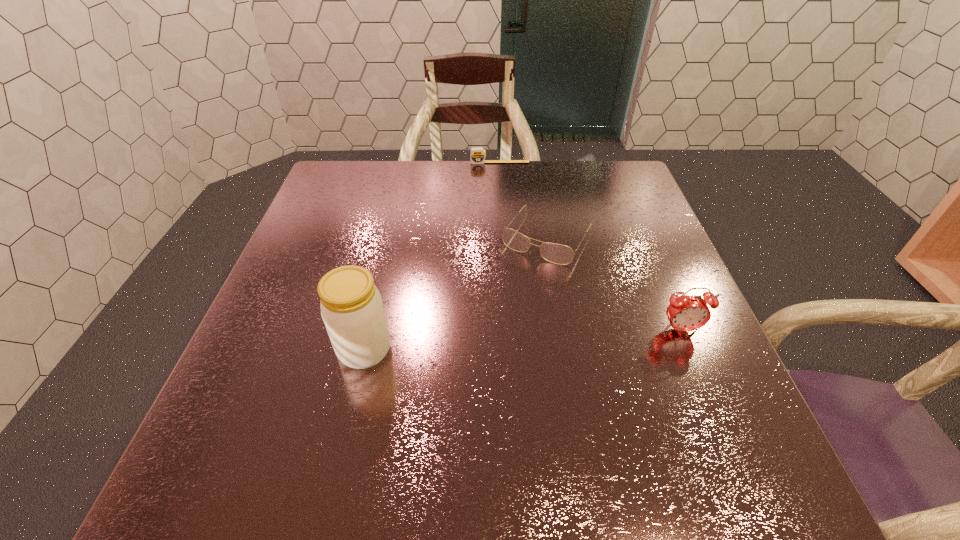
Identify the location of free space located on the front-facing side of the spectacles. [x=511, y=293].

Find the location of a particular element. free space located on the front-facing side of the spectacles is located at coordinates (497, 315).

Image resolution: width=960 pixels, height=540 pixels. I want to click on vacant space located 0.170m at the front of the shortest object with the tape extended, so click(503, 195).

Locate an element on the screen. vacant space located at the front of the shortest object with the tape extended is located at coordinates (505, 219).

Locate an element on the screen. The width and height of the screenshot is (960, 540). vacant space situated 0.210m at the front of the shortest object with the tape extended is located at coordinates (504, 204).

This screenshot has height=540, width=960. I want to click on object that is at the far edge, so click(477, 156).

In order to click on object that is at the right edge in this screenshot , I will do `click(685, 313)`.

Where is `free space at the far edge of the desktop`? The width and height of the screenshot is (960, 540). free space at the far edge of the desktop is located at coordinates (397, 181).

I want to click on blank space at the near edge, so click(620, 401).

In the image, there is a desktop. Identify the location of vacant area at the left edge. (318, 348).